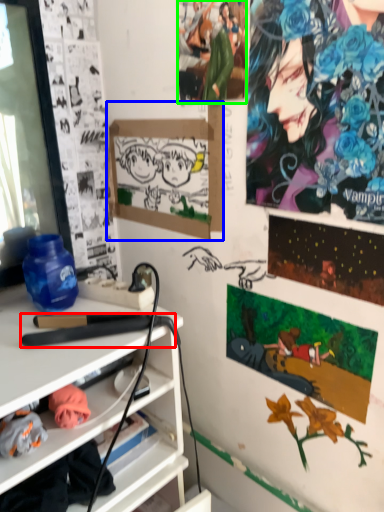
Question: Considering the real-world distances, which object is farthest from equipment (highlighted by a red box)? bulletin board (highlighted by a blue box) or person (highlighted by a green box)?

Choices:
 (A) bulletin board
 (B) person

Answer: (B)